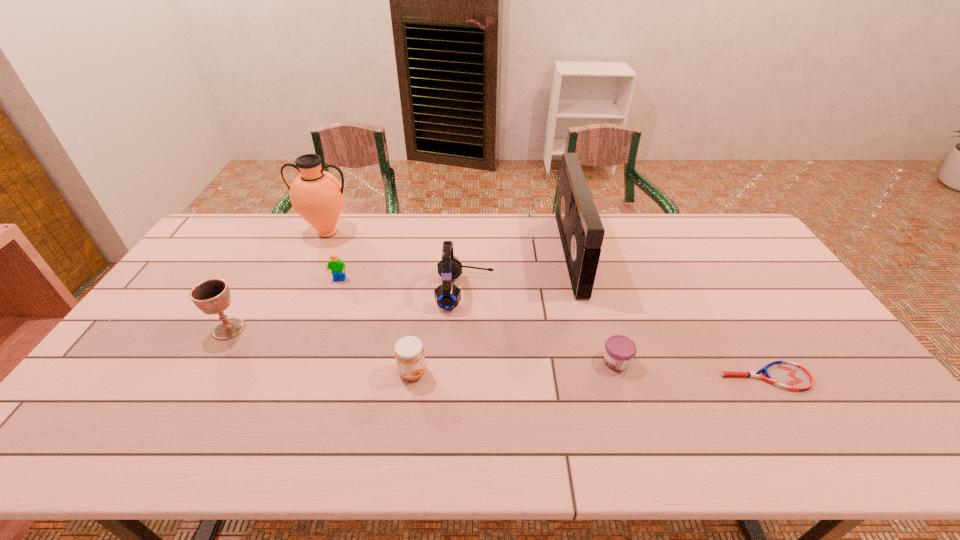
In order to click on free space located on the front label of the fourth object from left to right in this screenshot , I will do `click(564, 372)`.

Locate an element on the screen. The height and width of the screenshot is (540, 960). free space located on the front label of the shorter jam is located at coordinates (496, 362).

The height and width of the screenshot is (540, 960). I want to click on free space located 0.210m on the front label of the shorter jam, so (x=522, y=362).

Find the location of a particular element. free location located 0.240m on the front label of the shorter jam is located at coordinates [512, 362].

Find the location of a particular element. blank space located 0.130m on the back of the shortest object is located at coordinates (736, 327).

At what (x,y) coordinates should I click in order to perform the action: click on pitcher located at the far edge. Please return your answer as a coordinate pair (x, y). This screenshot has height=540, width=960. Looking at the image, I should click on (317, 196).

The image size is (960, 540). I want to click on videotape at the far edge, so click(581, 231).

Image resolution: width=960 pixels, height=540 pixels. I want to click on object located at the right edge, so click(788, 375).

Locate an element on the screen. The height and width of the screenshot is (540, 960). vacant space at the far edge of the desktop is located at coordinates (663, 230).

At what (x,y) coordinates should I click in order to perform the action: click on free point at the near edge. Please return your answer as a coordinate pair (x, y). This screenshot has width=960, height=540. Looking at the image, I should click on (219, 427).